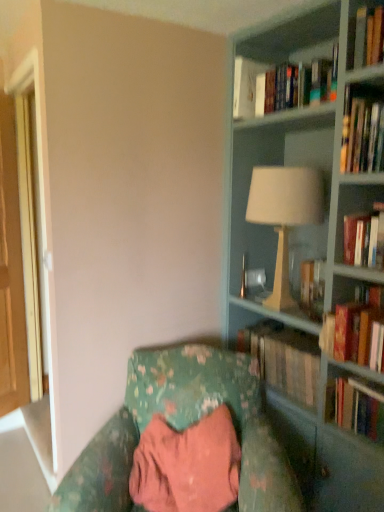
Question: Is hardcover book at right, the third book when ordered from bottom to top, at the back of matte gray bookcase at right?

Choices:
 (A) yes
 (B) no

Answer: (A)

Question: Can you confirm if matte gray bookcase at right is wider than hardcover book at right, which is the third book from top to bottom?

Choices:
 (A) no
 (B) yes

Answer: (B)

Question: From the image's perspective, would you say matte gray bookcase at right is shown under hardcover book at right, which is the third book from top to bottom?

Choices:
 (A) no
 (B) yes

Answer: (A)

Question: Is hardcover book at right, the third book when ordered from bottom to top, completely or partially inside matte gray bookcase at right?

Choices:
 (A) no
 (B) yes

Answer: (B)

Question: Are matte gray bookcase at right and hardcover book at right, the third book when ordered from bottom to top, making contact?

Choices:
 (A) yes
 (B) no

Answer: (B)

Question: From the image's perspective, is white ceramic lamp at upper right above or below hardcover book at right, which appears as the 5th book when viewed from the top?

Choices:
 (A) above
 (B) below

Answer: (A)

Question: Does point (236, 208) appear closer or farther from the camera than point (357, 415)?

Choices:
 (A) closer
 (B) farther

Answer: (B)

Question: Is white ceramic lamp at upper right to the left or to the right of hardcover book at right, which appears as the first book when ordered from the bottom, in the image?

Choices:
 (A) right
 (B) left

Answer: (B)

Question: In the image, is white ceramic lamp at upper right positioned in front of or behind hardcover book at right, which appears as the 5th book when viewed from the top?

Choices:
 (A) behind
 (B) front

Answer: (A)

Question: From the image's perspective, relative to matte gray bookcase at right, is white paper at upper center, acting as the 1th book starting from the top, above or below?

Choices:
 (A) above
 (B) below

Answer: (A)

Question: Does point (251, 71) appear closer or farther from the camera than point (342, 436)?

Choices:
 (A) farther
 (B) closer

Answer: (A)

Question: Considering the positions of white paper at upper center, the 5th book in the bottom-to-top sequence, and matte gray bookcase at right in the image, is white paper at upper center, the 5th book in the bottom-to-top sequence, bigger or smaller than matte gray bookcase at right?

Choices:
 (A) big
 (B) small

Answer: (B)

Question: Considering the relative positions of white paper at upper center, the 5th book in the bottom-to-top sequence, and matte gray bookcase at right in the image provided, is white paper at upper center, the 5th book in the bottom-to-top sequence, to the left or to the right of matte gray bookcase at right?

Choices:
 (A) left
 (B) right

Answer: (A)

Question: From their relative heights in the image, would you say hardcover book at center, marked as the 4th book in a top-to-bottom arrangement, is taller or shorter than hardcover book at right, the third book when ordered from bottom to top?

Choices:
 (A) tall
 (B) short

Answer: (B)

Question: From the image's perspective, is hardcover book at center, the second book positioned from the bottom, located above or below hardcover book at right, which is the third book from top to bottom?

Choices:
 (A) above
 (B) below

Answer: (B)